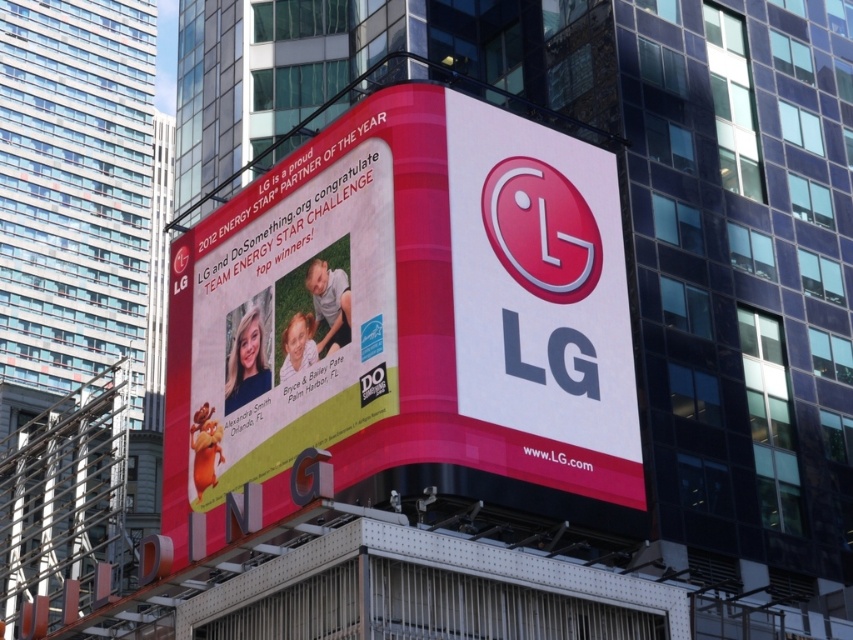
Based on the photo, you are standing in front of the billboard and want to touch both the matte plastic billboard at center and the matte pink banner at center. Which object should you reach for first to touch the one closer to you?

The matte plastic billboard at center is closer to the viewer than the matte pink banner at center, so you should reach for the matte plastic billboard at center first.

You are standing on the sidewalk across the street from the matte plastic billboard at center. You want to take a photo of the billboard with your smartphone. Considering the distance, will the billboard appear blurry in your photo if you don

The matte plastic billboard at center is 122.11 feet away from the viewer. Since most smartphones can focus clearly up to 100 feet, the billboard may appear slightly blurry in the photo due to the distance exceeding the typical focus range.

You are standing at the corner of the street, and you want to take a photo of the matte plastic billboard at center. Which direction should you face to ensure the billboard is centered in your camera view?

Since the matte plastic billboard at center is located at point coordinates (x=404, y=314), you should face directly towards the center of the building where the billboard is mounted to ensure it is centered in your camera view.